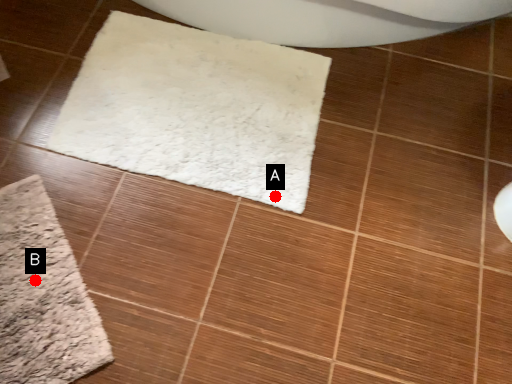
Question: Two points are circled on the image, labeled by A and B beside each circle. Which point appears farthest from the camera in this image?

Choices:
 (A) A is further
 (B) B is further

Answer: (A)